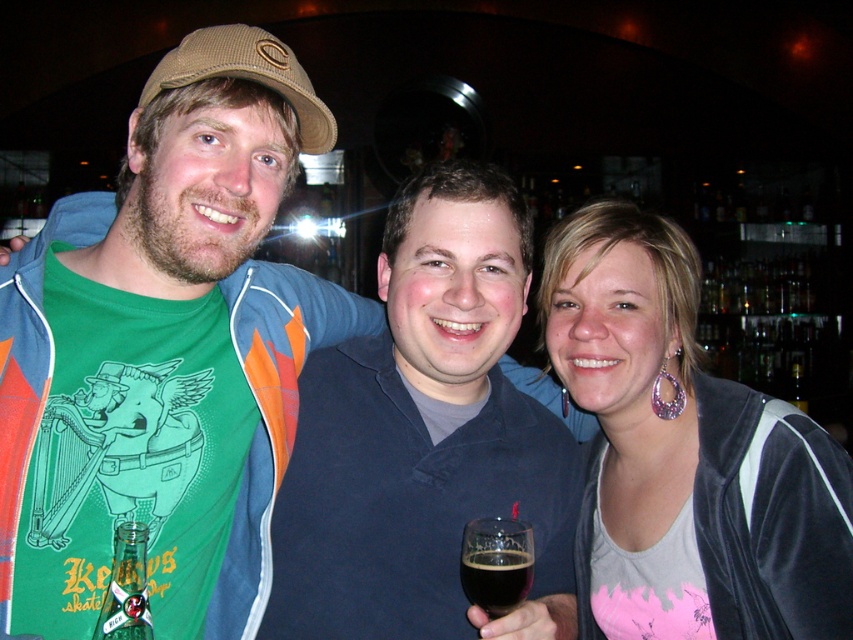
What is the color of the jacket at point [682,452]?

The jacket at point [682,452] is matte black.

You are a photographer trying to capture a clear shot of the dark blue shirt at center and the matte black jacket at center. Since the lighting is low, you want to ensure both are visible. Based on their positions, which one is closer to the light source?

The dark blue shirt at center is above the matte black jacket at center, so it is closer to the light source.